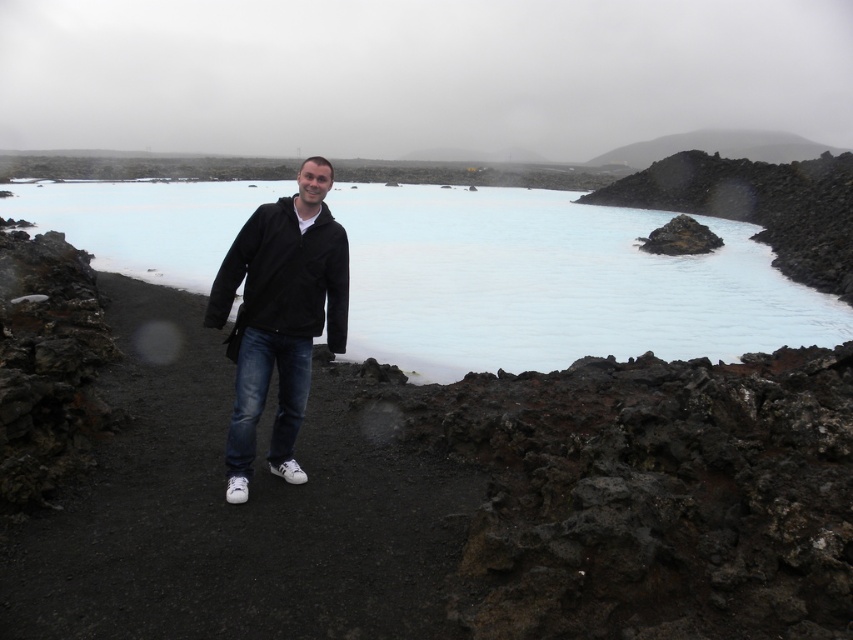
Question: Is blue smooth water at center to the left of black matte jacket at center from the viewer's perspective?

Choices:
 (A) yes
 (B) no

Answer: (A)

Question: Among these objects, which one is farthest from the camera?

Choices:
 (A) black matte jacket at center
 (B) blue smooth water at center

Answer: (B)

Question: Does blue smooth water at center have a lesser width compared to black matte jacket at center?

Choices:
 (A) yes
 (B) no

Answer: (B)

Question: Can you confirm if blue smooth water at center is thinner than black matte jacket at center?

Choices:
 (A) yes
 (B) no

Answer: (B)

Question: Which of the following is the farthest from the observer?

Choices:
 (A) (733, 259)
 (B) (252, 369)

Answer: (A)